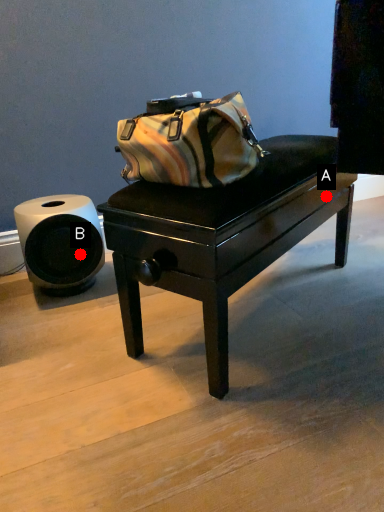
Question: Two points are circled on the image, labeled by A and B beside each circle. Which point is further to the camera?

Choices:
 (A) A is further
 (B) B is further

Answer: (B)